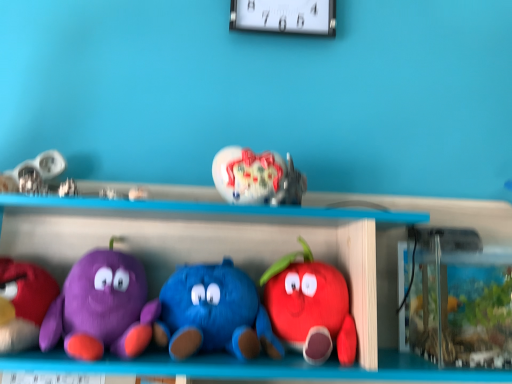
I want to click on satin silver toy at upper center, which ranks as the 3th toy in left-to-right order, so click(137, 193).

Describe the element at coordinates (213, 313) in the screenshot. I see `blue plush toy at center, which ranks as the fourth toy in left-to-right order` at that location.

In the scene shown: What is the approximate width of matte purple plush at left, which is counted as the 5th toy, starting from the right?

matte purple plush at left, which is counted as the 5th toy, starting from the right, is 7.02 inches wide.

What do you see at coordinates (310, 307) in the screenshot?
I see `matte plush apple at center, the 6th toy from the left` at bounding box center [310, 307].

Where is `purple plush toy at left, marked as the 6th toy in a right-to-left arrangement`? purple plush toy at left, marked as the 6th toy in a right-to-left arrangement is located at coordinates (23, 303).

Which object is wider, white plastic clock at upper center or shiny glass vase at center, which is the second toy in right-to-left order?

Wider between the two is shiny glass vase at center, which is the second toy in right-to-left order.

Consider the image. Considering the relative positions of white plastic clock at upper center and shiny glass vase at center, the 5th toy when ordered from left to right, in the image provided, is white plastic clock at upper center to the left or to the right of shiny glass vase at center, the 5th toy when ordered from left to right,?

Based on their positions, white plastic clock at upper center is located to the right of shiny glass vase at center, the 5th toy when ordered from left to right.

Is white plastic clock at upper center oriented away from shiny glass vase at center, the 5th toy when ordered from left to right?

No, white plastic clock at upper center is not facing the opposite direction of shiny glass vase at center, the 5th toy when ordered from left to right.

From a real-world perspective, is matte plush apple at center, the first toy when ordered from right to left, located beneath blue plush toy at center, which ranks as the fourth toy in left-to-right order?

Incorrect, from a real-world perspective, matte plush apple at center, the first toy when ordered from right to left, is higher than blue plush toy at center, which ranks as the fourth toy in left-to-right order.

Looking at this image, considering the sizes of objects matte plush apple at center, the first toy when ordered from right to left, and blue plush toy at center, marked as the third toy in a right-to-left arrangement, in the image provided, who is thinner, matte plush apple at center, the first toy when ordered from right to left, or blue plush toy at center, marked as the third toy in a right-to-left arrangement,?

Thinner between the two is matte plush apple at center, the first toy when ordered from right to left.

Where is `toy located below the matte plush apple at center, the first toy when ordered from right to left (from the image's perspective)`? toy located below the matte plush apple at center, the first toy when ordered from right to left (from the image's perspective) is located at coordinates (213, 313).

Is matte plush apple at center, the 6th toy from the left, outside of blue plush toy at center, marked as the third toy in a right-to-left arrangement?

matte plush apple at center, the 6th toy from the left, is positioned outside blue plush toy at center, marked as the third toy in a right-to-left arrangement.

Could you measure the distance between blue plush toy at center, which ranks as the fourth toy in left-to-right order, and purple plush toy at left, which is the 1th toy in left-to-right order?

10.54 inches.

From the image's perspective, which is above, blue plush toy at center, which ranks as the fourth toy in left-to-right order, or purple plush toy at left, marked as the 6th toy in a right-to-left arrangement?

purple plush toy at left, marked as the 6th toy in a right-to-left arrangement, appears higher in the image.

Who is bigger, blue plush toy at center, marked as the third toy in a right-to-left arrangement, or purple plush toy at left, which is the 1th toy in left-to-right order?

purple plush toy at left, which is the 1th toy in left-to-right order.

Who is taller, shiny glass vase at center, which is the second toy in right-to-left order, or blue plush toy at center, which ranks as the fourth toy in left-to-right order?

blue plush toy at center, which ranks as the fourth toy in left-to-right order.

Is shiny glass vase at center, which is the second toy in right-to-left order, positioned beyond the bounds of blue plush toy at center, which ranks as the fourth toy in left-to-right order?

That's correct, shiny glass vase at center, which is the second toy in right-to-left order, is outside of blue plush toy at center, which ranks as the fourth toy in left-to-right order.

Is there a large distance between shiny glass vase at center, which is the second toy in right-to-left order, and blue plush toy at center, which ranks as the fourth toy in left-to-right order?

No, shiny glass vase at center, which is the second toy in right-to-left order, is not far from blue plush toy at center, which ranks as the fourth toy in left-to-right order.

Is shiny glass vase at center, the 5th toy when ordered from left to right, positioned in front of blue plush toy at center, marked as the third toy in a right-to-left arrangement?

No, shiny glass vase at center, the 5th toy when ordered from left to right, is behind blue plush toy at center, marked as the third toy in a right-to-left arrangement.

Does white plastic clock at upper center appear on the left side of purple plush toy at left, marked as the 6th toy in a right-to-left arrangement?

In fact, white plastic clock at upper center is to the right of purple plush toy at left, marked as the 6th toy in a right-to-left arrangement.

Is white plastic clock at upper center far from purple plush toy at left, marked as the 6th toy in a right-to-left arrangement?

That's not correct — white plastic clock at upper center is a little close to purple plush toy at left, marked as the 6th toy in a right-to-left arrangement.

At what (x,y) coordinates should I click in order to perform the action: click on the 5th toy counting from the left side of the white plastic clock at upper center. Please return your answer as a coordinate pair (x, y). Looking at the image, I should click on (23, 303).

Which of these two, white plastic clock at upper center or purple plush toy at left, marked as the 6th toy in a right-to-left arrangement, is bigger?

purple plush toy at left, marked as the 6th toy in a right-to-left arrangement.

Can you confirm if matte purple plush at left, which is counted as the 5th toy, starting from the right, is thinner than satin silver toy at upper center, which ranks as the 3th toy in left-to-right order?

No.

From the image's perspective, would you say matte purple plush at left, marked as the 2th toy in a left-to-right arrangement, is shown under satin silver toy at upper center, arranged as the 4th toy when viewed from the right?

Yes.

From a real-world perspective, which toy is the 2nd one underneath the satin silver toy at upper center, arranged as the 4th toy when viewed from the right? Please provide its 2D coordinates.

[(102, 307)]

Considering the relative positions of matte purple plush at left, which is counted as the 5th toy, starting from the right, and satin silver toy at upper center, arranged as the 4th toy when viewed from the right, in the image provided, is matte purple plush at left, which is counted as the 5th toy, starting from the right, to the right of satin silver toy at upper center, arranged as the 4th toy when viewed from the right, from the viewer's perspective?

In fact, matte purple plush at left, which is counted as the 5th toy, starting from the right, is to the left of satin silver toy at upper center, arranged as the 4th toy when viewed from the right.

Locate an element on the screen. toy that is the 1st one when counting backward from the matte purple plush at left, marked as the 2th toy in a left-to-right arrangement is located at coordinates (213, 313).

Would you say blue plush toy at center, marked as the third toy in a right-to-left arrangement, is to the left or to the right of matte purple plush at left, marked as the 2th toy in a left-to-right arrangement, in the picture?

blue plush toy at center, marked as the third toy in a right-to-left arrangement, is to the right of matte purple plush at left, marked as the 2th toy in a left-to-right arrangement.

Considering the sizes of blue plush toy at center, marked as the third toy in a right-to-left arrangement, and matte purple plush at left, marked as the 2th toy in a left-to-right arrangement, in the image, is blue plush toy at center, marked as the third toy in a right-to-left arrangement, wider or thinner than matte purple plush at left, marked as the 2th toy in a left-to-right arrangement,?

In the image, blue plush toy at center, marked as the third toy in a right-to-left arrangement, appears to be more narrow than matte purple plush at left, marked as the 2th toy in a left-to-right arrangement.

Can you confirm if blue plush toy at center, which ranks as the fourth toy in left-to-right order, is smaller than matte purple plush at left, which is counted as the 5th toy, starting from the right?

Yes, blue plush toy at center, which ranks as the fourth toy in left-to-right order, is smaller than matte purple plush at left, which is counted as the 5th toy, starting from the right.

Starting from the white plastic clock at upper center, which toy is the 2nd one in front? Please provide its 2D coordinates.

[(257, 177)]

Starting from the blue plush toy at center, marked as the third toy in a right-to-left arrangement, which toy is the 1st one behind? Please provide its 2D coordinates.

[(310, 307)]

When comparing their distances from white plastic clock at upper center, does satin silver toy at upper center, arranged as the 4th toy when viewed from the right, or blue plush toy at center, marked as the third toy in a right-to-left arrangement, seem closer?

satin silver toy at upper center, arranged as the 4th toy when viewed from the right, is positioned closer to the anchor white plastic clock at upper center.

Considering their positions, is white plastic clock at upper center positioned closer to purple plush toy at left, marked as the 6th toy in a right-to-left arrangement, than matte plush apple at center, the first toy when ordered from right to left?

matte plush apple at center, the first toy when ordered from right to left, is positioned closer to the anchor purple plush toy at left, marked as the 6th toy in a right-to-left arrangement.

Looking at this image, based on their spatial positions, is purple plush toy at left, marked as the 6th toy in a right-to-left arrangement, or satin silver toy at upper center, arranged as the 4th toy when viewed from the right, closer to blue plush toy at center, which ranks as the fourth toy in left-to-right order?

satin silver toy at upper center, arranged as the 4th toy when viewed from the right, is closer to blue plush toy at center, which ranks as the fourth toy in left-to-right order.

When comparing their distances from blue plush toy at center, which ranks as the fourth toy in left-to-right order, does purple plush toy at left, marked as the 6th toy in a right-to-left arrangement, or matte plush apple at center, the 6th toy from the left, seem further?

Based on the image, purple plush toy at left, marked as the 6th toy in a right-to-left arrangement, appears to be further to blue plush toy at center, which ranks as the fourth toy in left-to-right order.

Which object lies further to the anchor point white plastic clock at upper center, matte purple plush at left, which is counted as the 5th toy, starting from the right, or satin silver toy at upper center, arranged as the 4th toy when viewed from the right?

Based on the image, matte purple plush at left, which is counted as the 5th toy, starting from the right, appears to be further to white plastic clock at upper center.

From the image, which object appears to be farther from matte purple plush at left, which is counted as the 5th toy, starting from the right, purple plush toy at left, which is the 1th toy in left-to-right order, or satin silver toy at upper center, arranged as the 4th toy when viewed from the right?

Based on the image, satin silver toy at upper center, arranged as the 4th toy when viewed from the right, appears to be further to matte purple plush at left, which is counted as the 5th toy, starting from the right.

Estimate the real-world distances between objects in this image. Which object is further from blue plush toy at center, which ranks as the fourth toy in left-to-right order, satin silver toy at upper center, arranged as the 4th toy when viewed from the right, or matte purple plush at left, marked as the 2th toy in a left-to-right arrangement?

satin silver toy at upper center, arranged as the 4th toy when viewed from the right.

Estimate the real-world distances between objects in this image. Which object is further from purple plush toy at left, which is the 1th toy in left-to-right order, matte plush apple at center, the 6th toy from the left, or blue plush toy at center, which ranks as the fourth toy in left-to-right order?

Among the two, matte plush apple at center, the 6th toy from the left, is located further to purple plush toy at left, which is the 1th toy in left-to-right order.

I want to click on toy between purple plush toy at left, which is the 1th toy in left-to-right order, and satin silver toy at upper center, which ranks as the 3th toy in left-to-right order, in the horizontal direction, so [102, 307].

The image size is (512, 384). I want to click on toy that lies between white plastic clock at upper center and satin silver toy at upper center, arranged as the 4th toy when viewed from the right, from top to bottom, so click(x=257, y=177).